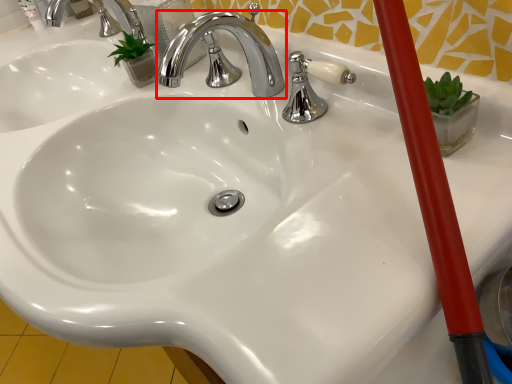
Question: From the image's perspective, considering the relative positions of tap (annotated by the red box) and tap in the image provided, where is tap (annotated by the red box) located with respect to the staircase?

Choices:
 (A) below
 (B) above

Answer: (A)